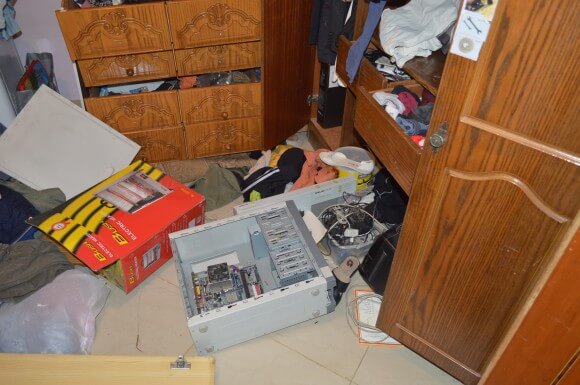
Where is `beige floor tile`? beige floor tile is located at coordinates (295, 361).